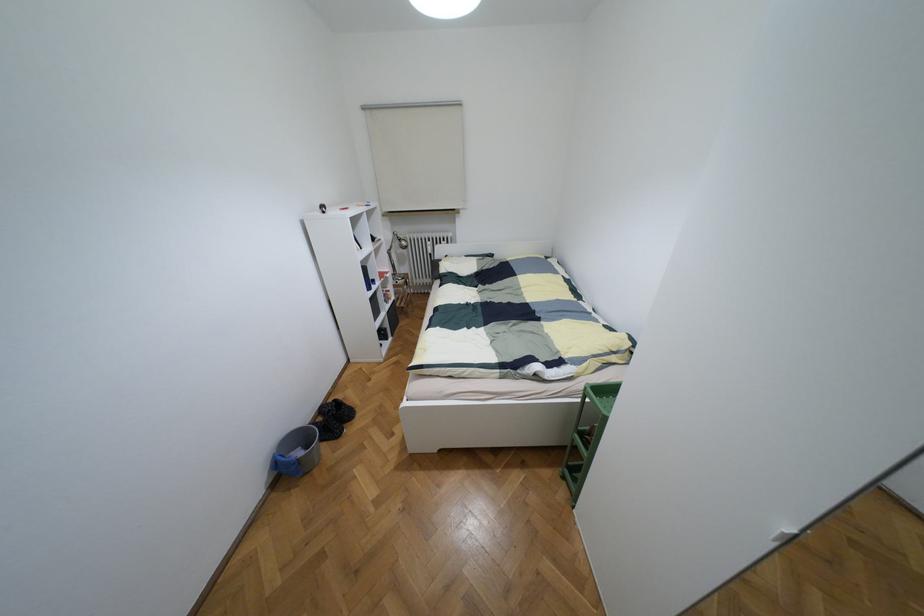
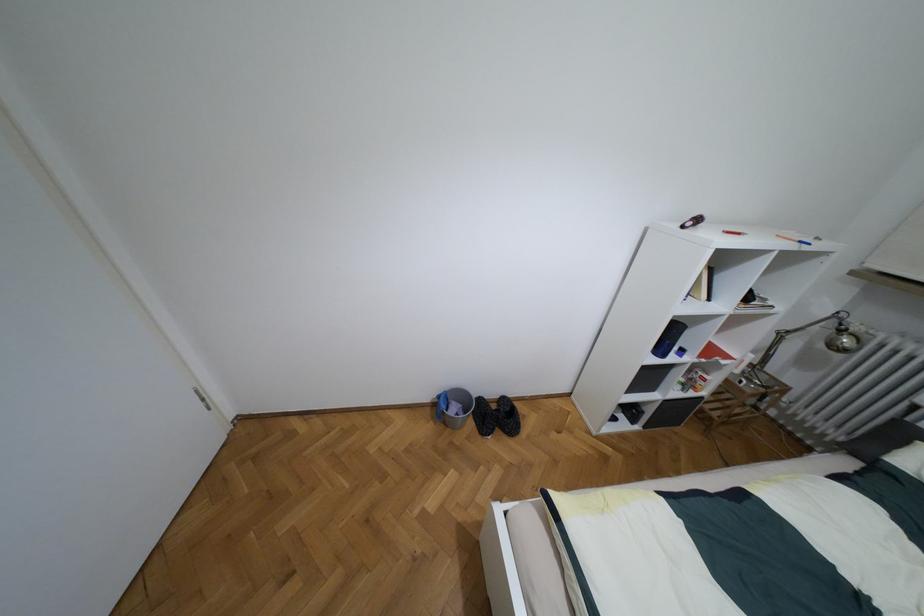
The point at (398, 238) is marked in the first image. Where is the corresponding point in the second image?

(840, 330)